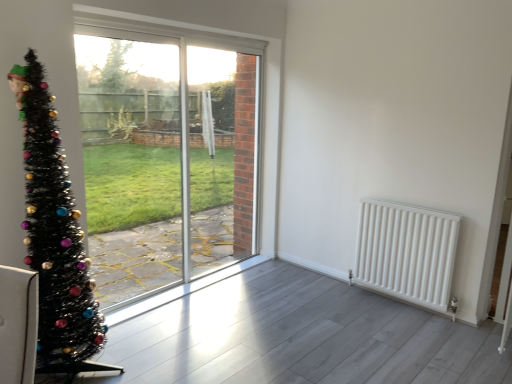
You are a GUI agent. You are given a task and a screenshot of the screen. Output one action in this format:
    pyautogui.click(x=<x>, y=<y>)
    Task: Click on the white matte radiator at right
    The height and width of the screenshot is (384, 512).
    Given the screenshot: What is the action you would take?
    pyautogui.click(x=406, y=252)

In order to click on transparent glass window at center in this screenshot , I will do `click(167, 153)`.

What are the coordinates of `black tinsel christmas tree at left` in the screenshot? It's located at (55, 236).

I want to click on white matte radiator at right, so click(406, 252).

Is clear glass screen door at center oriented towards transparent glass window at center?

Yes.

Can you confirm if clear glass screen door at center is taller than transparent glass window at center?

No.

From the image's perspective, does clear glass screen door at center appear lower than transparent glass window at center?

Incorrect, from the image's perspective, clear glass screen door at center is higher than transparent glass window at center.

Between clear glass screen door at center and transparent glass window at center, which one has smaller size?

With smaller size is clear glass screen door at center.

Considering the positions of objects transparent glass window at center and black tinsel christmas tree at left in the image provided, who is more to the right, transparent glass window at center or black tinsel christmas tree at left?

transparent glass window at center is more to the right.

Are transparent glass window at center and black tinsel christmas tree at left far apart?

Yes, transparent glass window at center is far from black tinsel christmas tree at left.

From the image's perspective, which is above, transparent glass window at center or black tinsel christmas tree at left?

transparent glass window at center, from the image's perspective.

From a real-world perspective, is black tinsel christmas tree at left above or below clear glass screen door at center?

From a real-world perspective, black tinsel christmas tree at left is physically below clear glass screen door at center.

Is black tinsel christmas tree at left further to camera compared to clear glass screen door at center?

No, the depth of black tinsel christmas tree at left is less than that of clear glass screen door at center.

Which is more to the left, black tinsel christmas tree at left or clear glass screen door at center?

black tinsel christmas tree at left.

Which is closer, (x=74, y=233) or (x=227, y=82)?

Clearly, point (x=74, y=233) is closer to the camera than point (x=227, y=82).

Consider the image. Is white matte radiator at right smaller than clear glass screen door at center?

Indeed, white matte radiator at right has a smaller size compared to clear glass screen door at center.

Find the location of a particular element. radiator that is in front of the clear glass screen door at center is located at coordinates coord(406,252).

Is white matte radiator at right facing away from clear glass screen door at center?

No.

From the image's perspective, is white matte radiator at right located above or below clear glass screen door at center?

Based on their image positions, white matte radiator at right is located beneath clear glass screen door at center.

Is white matte radiator at right with transparent glass window at center?

No.

Based on the photo, is white matte radiator at right to the right of transparent glass window at center from the viewer's perspective?

Indeed, white matte radiator at right is positioned on the right side of transparent glass window at center.

From a real-world perspective, is white matte radiator at right above or below transparent glass window at center?

Clearly, from a real-world perspective, white matte radiator at right is below transparent glass window at center.

Consider the image. In terms of width, does white matte radiator at right look wider or thinner when compared to transparent glass window at center?

Clearly, white matte radiator at right has more width compared to transparent glass window at center.

From the image's perspective, which one is positioned lower, transparent glass window at center or white matte radiator at right?

white matte radiator at right is shown below in the image.

Looking at the image, does transparent glass window at center seem bigger or smaller compared to white matte radiator at right?

Clearly, transparent glass window at center is larger in size than white matte radiator at right.

Is transparent glass window at center far from white matte radiator at right?

Yes, transparent glass window at center is far from white matte radiator at right.

Can you confirm if transparent glass window at center is positioned to the right of white matte radiator at right?

In fact, transparent glass window at center is to the left of white matte radiator at right.

Is black tinsel christmas tree at left at the right side of transparent glass window at center?

No.

Is transparent glass window at center at the back of black tinsel christmas tree at left?

No.

Which object is more forward, black tinsel christmas tree at left or transparent glass window at center?

black tinsel christmas tree at left is more forward.

Consider the image. Is black tinsel christmas tree at left beside transparent glass window at center?

black tinsel christmas tree at left and transparent glass window at center are not in contact.

Where is `window positioned vertically above the clear glass screen door at center (from a real-world perspective)`? The height and width of the screenshot is (384, 512). window positioned vertically above the clear glass screen door at center (from a real-world perspective) is located at coordinates (167, 153).

Where is `christmas tree located on the left of transparent glass window at center`? The width and height of the screenshot is (512, 384). christmas tree located on the left of transparent glass window at center is located at coordinates point(55,236).

Which object lies further to the anchor point transparent glass window at center, white matte radiator at right or black tinsel christmas tree at left?

white matte radiator at right is positioned further to the anchor transparent glass window at center.

Which object lies nearer to the anchor point clear glass screen door at center, black tinsel christmas tree at left or transparent glass window at center?

transparent glass window at center is closer to clear glass screen door at center.

Based on their spatial positions, is clear glass screen door at center or white matte radiator at right further from transparent glass window at center?

white matte radiator at right is further to transparent glass window at center.

Based on their spatial positions, is black tinsel christmas tree at left or white matte radiator at right closer to clear glass screen door at center?

The object closer to clear glass screen door at center is white matte radiator at right.

In the scene shown: Looking at the image, which one is located closer to transparent glass window at center, clear glass screen door at center or black tinsel christmas tree at left?

Based on the image, clear glass screen door at center appears to be nearer to transparent glass window at center.

Considering their positions, is black tinsel christmas tree at left positioned further to white matte radiator at right than clear glass screen door at center?

black tinsel christmas tree at left is positioned further to the anchor white matte radiator at right.

From the image, which object appears to be farther from transparent glass window at center, black tinsel christmas tree at left or clear glass screen door at center?

Among the two, black tinsel christmas tree at left is located further to transparent glass window at center.

When comparing their distances from white matte radiator at right, does black tinsel christmas tree at left or transparent glass window at center seem further?

black tinsel christmas tree at left.

Locate an element on the screen. The image size is (512, 384). screen door between black tinsel christmas tree at left and white matte radiator at right in the horizontal direction is located at coordinates (211, 156).

What are the coordinates of `window positioned between black tinsel christmas tree at left and clear glass screen door at center from near to far` in the screenshot? It's located at (167, 153).

Where is `screen door situated between transparent glass window at center and white matte radiator at right from left to right`? screen door situated between transparent glass window at center and white matte radiator at right from left to right is located at coordinates (211, 156).

Find the location of a particular element. Image resolution: width=512 pixels, height=384 pixels. window between black tinsel christmas tree at left and white matte radiator at right is located at coordinates (167, 153).